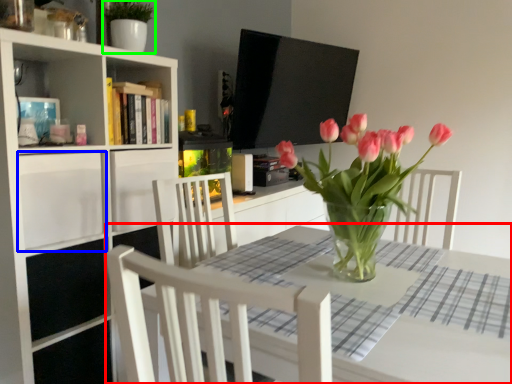
Question: Estimate the real-world distances between objects in this image. Which object is closer to table (highlighted by a red box), drawer (highlighted by a blue box) or plant (highlighted by a green box)?

Choices:
 (A) drawer
 (B) plant

Answer: (A)